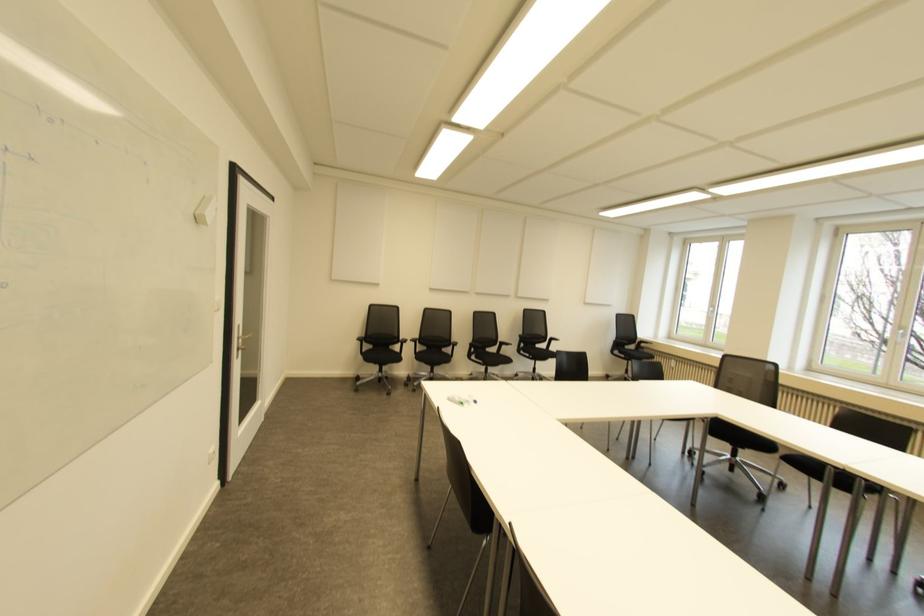
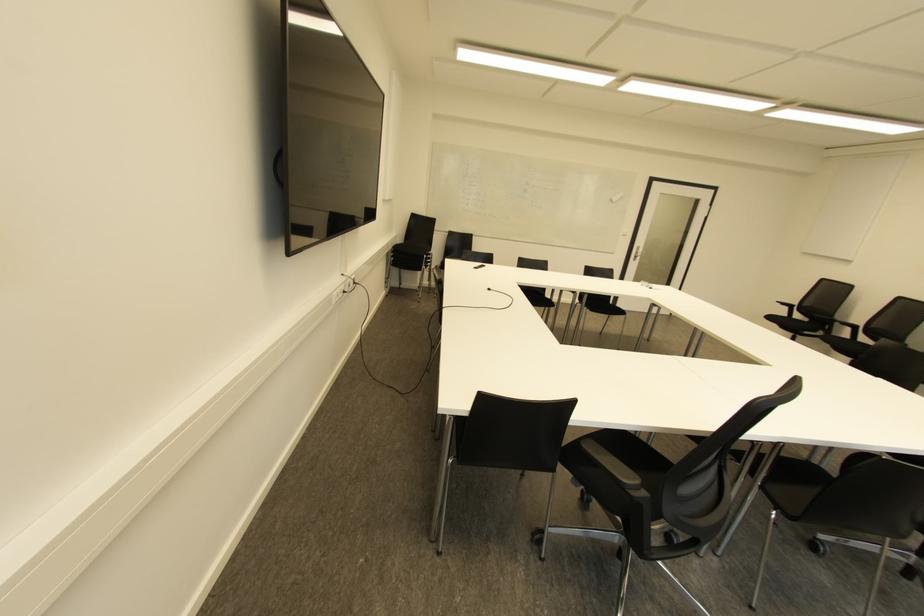
The point at [359,342] is marked in the first image. Where is the corresponding point in the second image?

(785, 307)